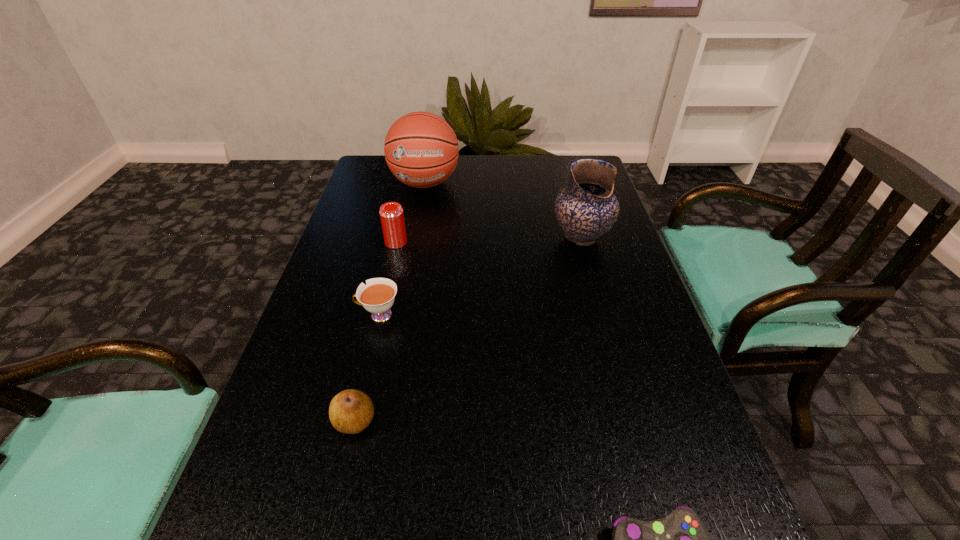
What are the coordinates of `free area in between the fifth farthest object and the pottery` in the screenshot? It's located at (468, 329).

Find the location of a particular element. The image size is (960, 540). vacant space that is in between the beer can and the pottery is located at coordinates (489, 240).

The width and height of the screenshot is (960, 540). I want to click on vacant point located between the pottery and the beer can, so click(x=489, y=240).

I want to click on free spot between the pottery and the basketball, so click(503, 210).

You are a GUI agent. You are given a task and a screenshot of the screen. Output one action in this format:
    pyautogui.click(x=<x>, y=<y>)
    Task: Click on the vacant area between the basketball and the teacup
    This screenshot has height=540, width=960.
    Given the screenshot: What is the action you would take?
    pyautogui.click(x=402, y=249)

The image size is (960, 540). I want to click on unoccupied area between the fifth tallest object and the pottery, so click(480, 276).

Find the location of a particular element. vacant area between the basketball and the teacup is located at coordinates (402, 249).

Locate an element on the screen. object that is the closest one to the farthest object is located at coordinates (391, 213).

Locate an element on the screen. This screenshot has width=960, height=540. the third closest object relative to the pottery is located at coordinates (378, 296).

You are a GUI agent. You are given a task and a screenshot of the screen. Output one action in this format:
    pyautogui.click(x=<x>, y=<y>)
    Task: Click on the free point that satisfies the following two spatial constraints: 1. on the side of the pear with the handle; 2. on the right side of the second shortest object
    The width and height of the screenshot is (960, 540).
    Given the screenshot: What is the action you would take?
    pyautogui.click(x=354, y=421)